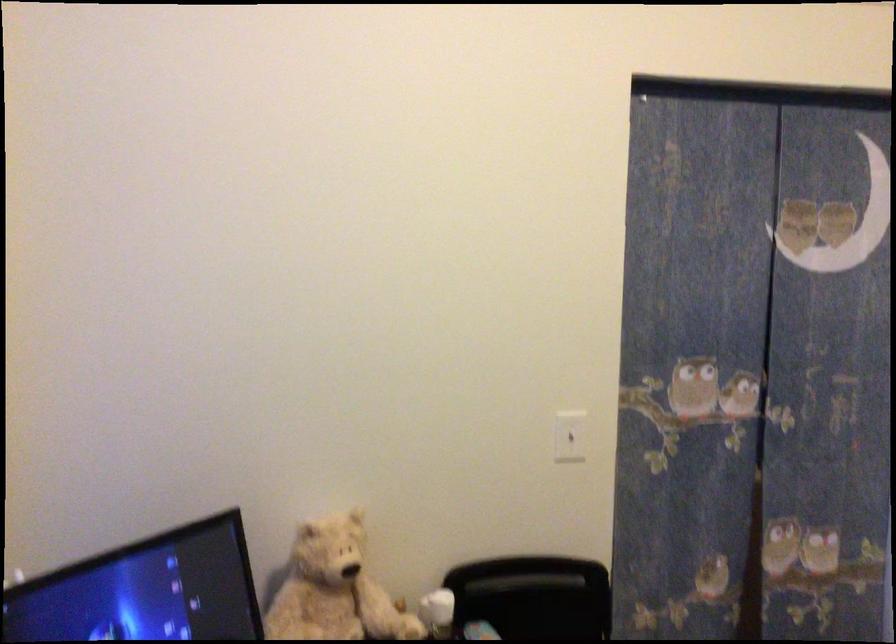
Locate an element on the screen. Image resolution: width=896 pixels, height=644 pixels. white light switch is located at coordinates (570, 436).